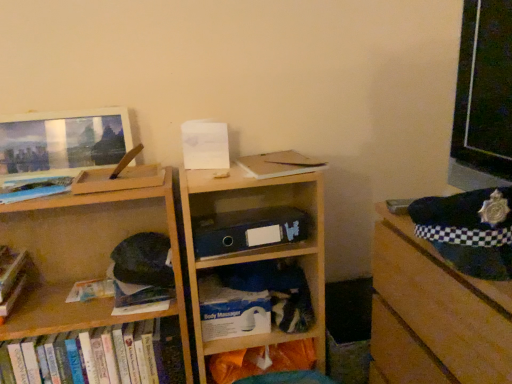
Question: In terms of size, does wooden bookshelf at left, the 2th shelf when ordered from right to left, appear bigger or smaller than white plastic body massager at lower center, marked as the 2th shelf in a left-to-right arrangement?

Choices:
 (A) big
 (B) small

Answer: (A)

Question: Would you say wooden bookshelf at left, marked as the 1th shelf in a left-to-right arrangement, is to the left or to the right of white plastic body massager at lower center, marked as the 2th shelf in a left-to-right arrangement, in the picture?

Choices:
 (A) left
 (B) right

Answer: (A)

Question: Based on their relative distances, which object is farther from the white plastic body massager at lower center, marked as the 2th shelf in a left-to-right arrangement?

Choices:
 (A) black checkered fabric at right
 (B) matte wooden frame at upper left
 (C) matte blue book at left, which appears as the 1th book when viewed from the top
 (D) white matte paperback book at center
 (E) wooden bookshelf at left, marked as the 1th shelf in a left-to-right arrangement

Answer: (B)

Question: Estimate the real-world distances between objects in this image. Which object is farther from the wooden bookshelf at center?

Choices:
 (A) matte blue book at left, which appears as the 1th book when viewed from the top
 (B) matte wooden frame at upper left
 (C) white plastic body massager at lower center, which is counted as the first shelf, starting from the right
 (D) white matte paperback book at center
 (E) hardcover books at lower left, arranged as the 2th book when viewed from the top

Answer: (A)